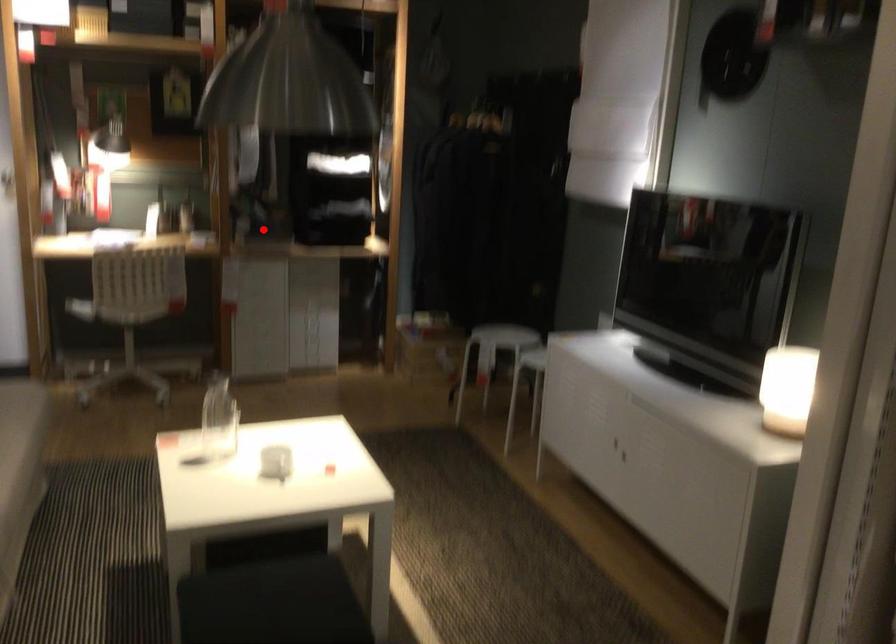
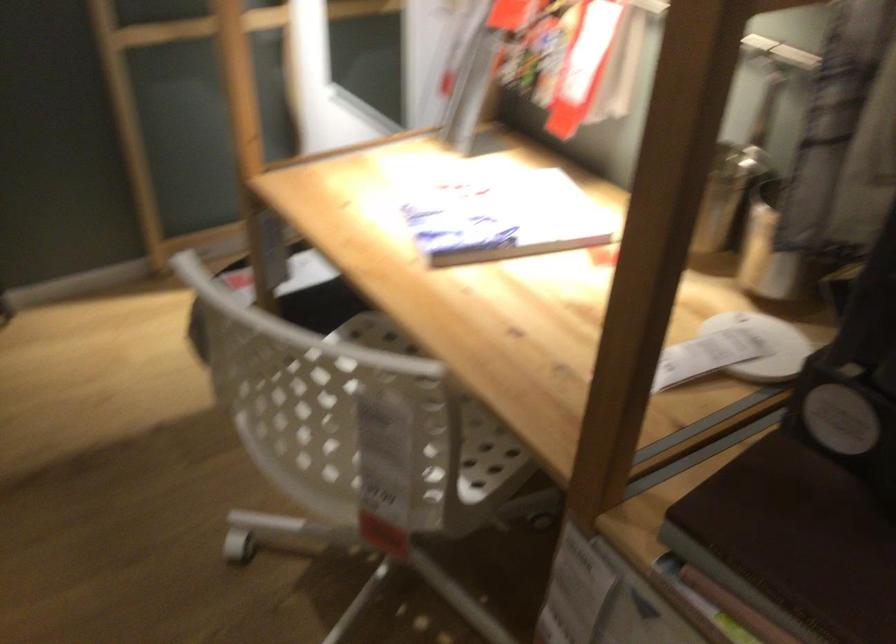
Question: I am providing you with two images of the same scene from different viewpoints. A red point is shown in image1. For the corresponding object point in image2, is it positioned nearer or farther from the camera?

Choices:
 (A) Nearer
 (B) Farther

Answer: (A)